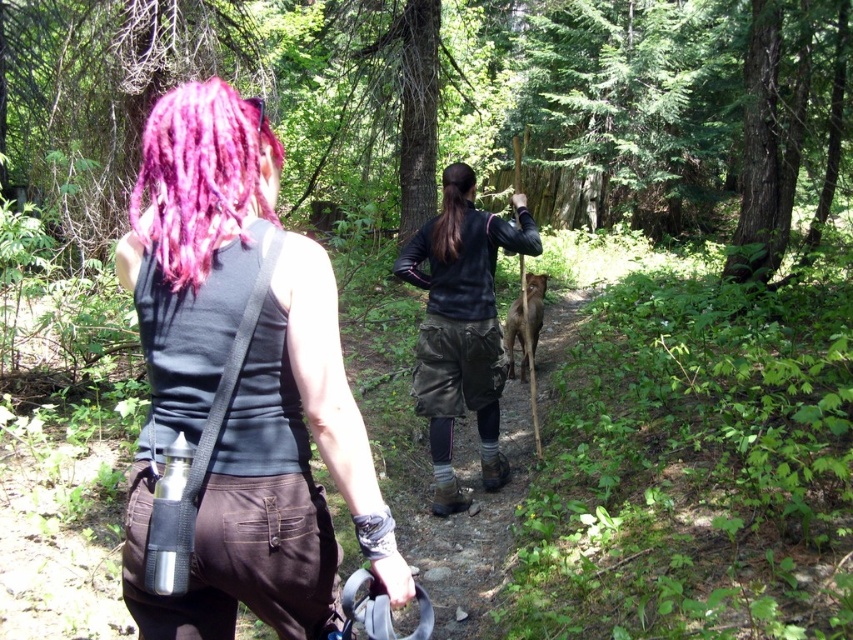
Question: Can you confirm if matte black tank top at upper left is bigger than dark gray leather jacket at center?

Choices:
 (A) no
 (B) yes

Answer: (A)

Question: Which point appears farthest from the camera in this image?

Choices:
 (A) (462, 188)
 (B) (199, 180)
 (C) (194, 168)

Answer: (A)

Question: Which object is the closest to the dark gray leather jacket at center?

Choices:
 (A) black silky hair at center
 (B) pink dreadlocks at upper left

Answer: (A)

Question: Considering the real-world distances, which object is closest to the dark gray leather jacket at center?

Choices:
 (A) matte black tank top at upper left
 (B) pink dreadlocks at upper left

Answer: (A)

Question: Is matte black tank top at upper left wider than black silky hair at center?

Choices:
 (A) no
 (B) yes

Answer: (B)

Question: Does matte black tank top at upper left appear under dark gray leather jacket at center?

Choices:
 (A) no
 (B) yes

Answer: (A)